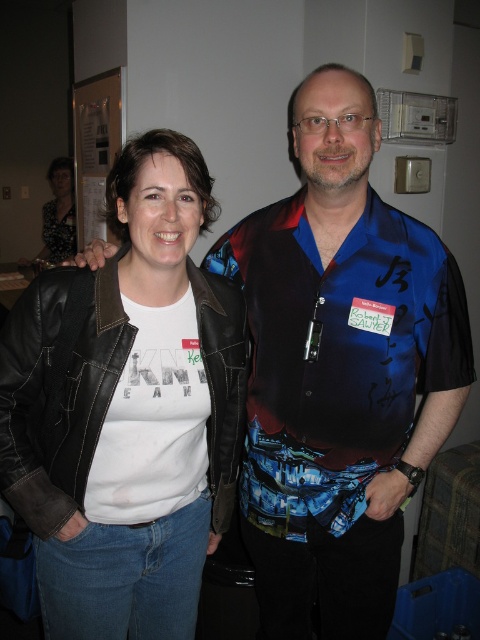
Question: Can you confirm if leather jacket at left is bigger than patterned fabric blouse at upper left?

Choices:
 (A) no
 (B) yes

Answer: (A)

Question: Can you confirm if leather jacket at left is positioned to the right of patterned fabric blouse at upper left?

Choices:
 (A) yes
 (B) no

Answer: (A)

Question: Among these points, which one is nearest to the camera?

Choices:
 (A) pos(104,637)
 (B) pos(61,234)

Answer: (A)

Question: Which point is farther from the camera taking this photo?

Choices:
 (A) (137, 564)
 (B) (69, 163)

Answer: (B)

Question: Can you confirm if leather jacket at left is wider than patterned fabric blouse at upper left?

Choices:
 (A) yes
 (B) no

Answer: (A)